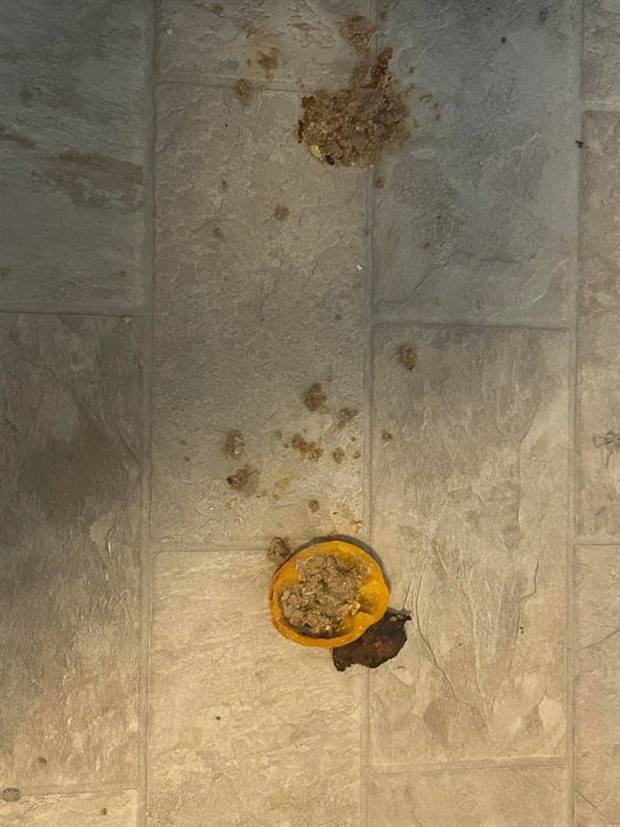
Identify the location of tile. The width and height of the screenshot is (620, 827). (93, 337).